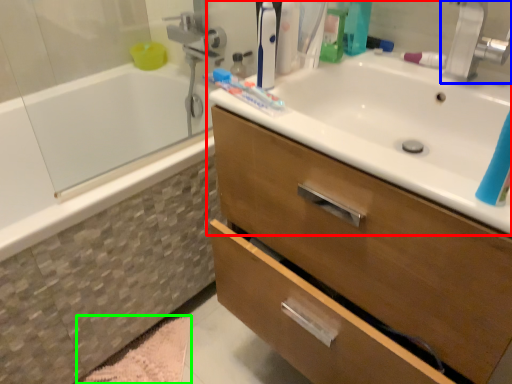
Question: Which object is the closest to the sink (highlighted by a red box)? Choose among these: tap (highlighted by a blue box) or bath mat (highlighted by a green box).

Choices:
 (A) tap
 (B) bath mat

Answer: (A)